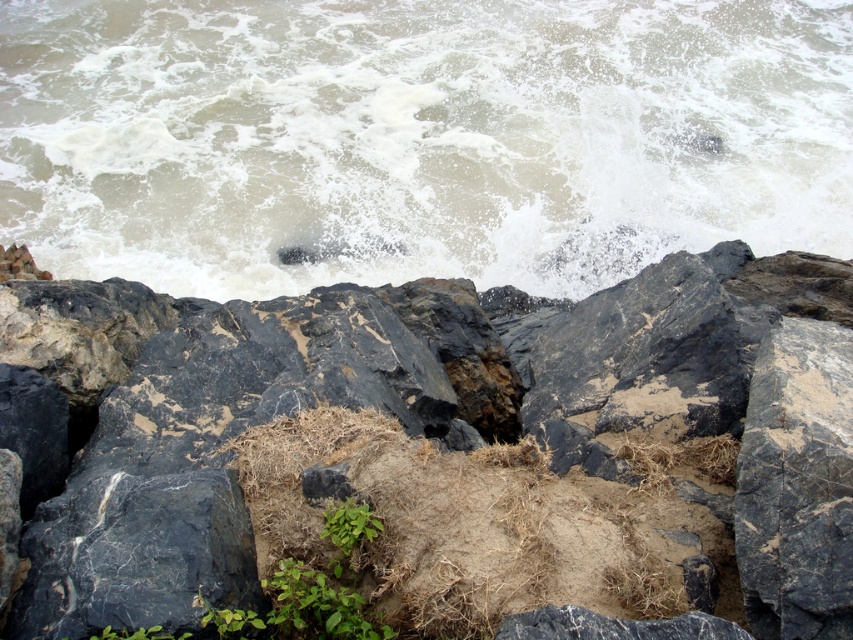
Question: Which object is positioned farthest from the white frothy water at upper center?

Choices:
 (A) black rough rock at center
 (B) green leafy plant at center

Answer: (B)

Question: Is black rough rock at center below green leafy plant at center?

Choices:
 (A) no
 (B) yes

Answer: (A)

Question: Is black marble rock at center to the left of green leafy plant at center from the viewer's perspective?

Choices:
 (A) no
 (B) yes

Answer: (A)

Question: Is black marble rock at center to the right of green leafy plant at center from the viewer's perspective?

Choices:
 (A) no
 (B) yes

Answer: (B)

Question: Which object appears farthest from the camera in this image?

Choices:
 (A) black marble rock at center
 (B) white frothy water at upper center

Answer: (B)

Question: Which point appears farthest from the camera in this image?

Choices:
 (A) (811, 237)
 (B) (817, 460)
 (C) (142, 632)
 (D) (320, 428)

Answer: (A)